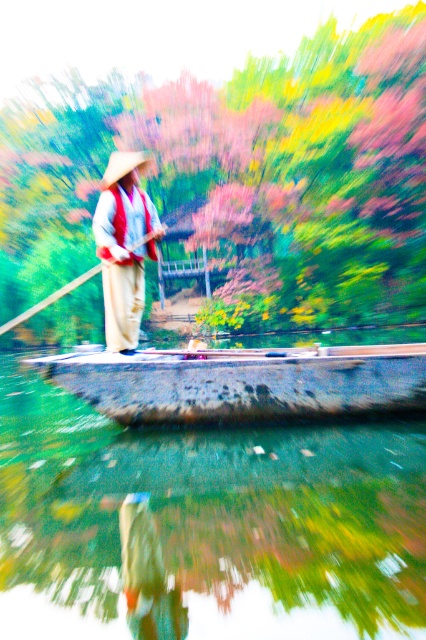
Question: Considering the real-world distances, which object is farthest from the wooden boat at center?

Choices:
 (A) matte beige hat at center
 (B) green smooth river at center
 (C) wooden paddle at center

Answer: (C)

Question: Does matte beige hat at center lie behind wooden paddle at center?

Choices:
 (A) no
 (B) yes

Answer: (A)

Question: Is green smooth river at center thinner than wooden paddle at center?

Choices:
 (A) no
 (B) yes

Answer: (B)

Question: Observing the image, what is the correct spatial positioning of green smooth river at center in reference to matte beige hat at center?

Choices:
 (A) below
 (B) above

Answer: (A)

Question: Which object appears closest to the camera in this image?

Choices:
 (A) green smooth river at center
 (B) wooden paddle at center
 (C) matte beige hat at center
 (D) wooden boat at center

Answer: (A)

Question: Which object is closer to the camera taking this photo?

Choices:
 (A) wooden boat at center
 (B) green smooth river at center
 (C) matte beige hat at center
 (D) wooden paddle at center

Answer: (B)